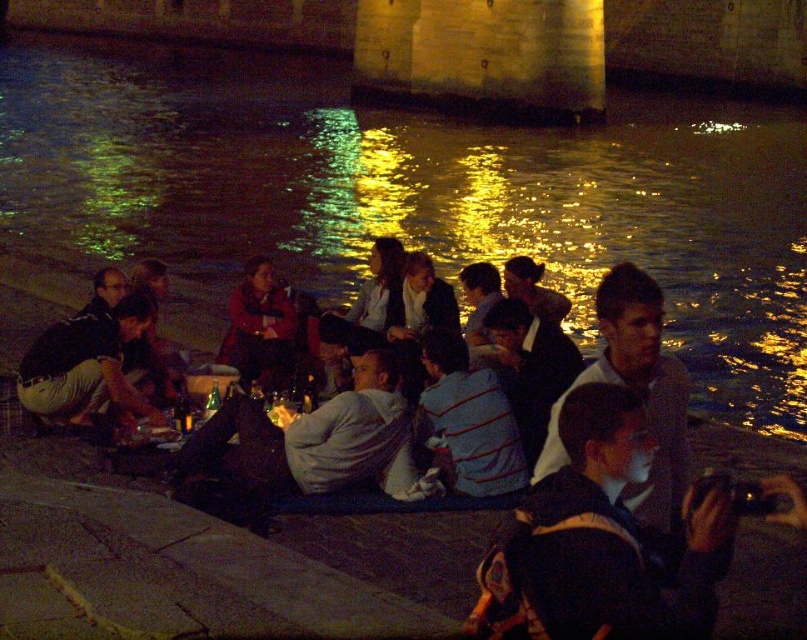
Question: Which point is closer to the camera?

Choices:
 (A) (630, 301)
 (B) (245, 326)
 (C) (550, 552)
 (D) (101, 412)

Answer: (C)

Question: Which point is closer to the camera?

Choices:
 (A) light brown leather jacket at lower left
 (B) black fabric jacket at lower right
 (C) matte red jacket at center

Answer: (B)

Question: Which point is farther from the camera taking this photo?

Choices:
 (A) (157, 422)
 (B) (676, 579)
 (C) (555, 452)

Answer: (A)

Question: Can you confirm if black fabric jacket at lower right is thinner than matte red jacket at center?

Choices:
 (A) yes
 (B) no

Answer: (B)

Question: Is light brown hair at center thinner than matte red jacket at center?

Choices:
 (A) yes
 (B) no

Answer: (B)

Question: Does black fabric jacket at lower right appear over light brown hair at center?

Choices:
 (A) no
 (B) yes

Answer: (A)